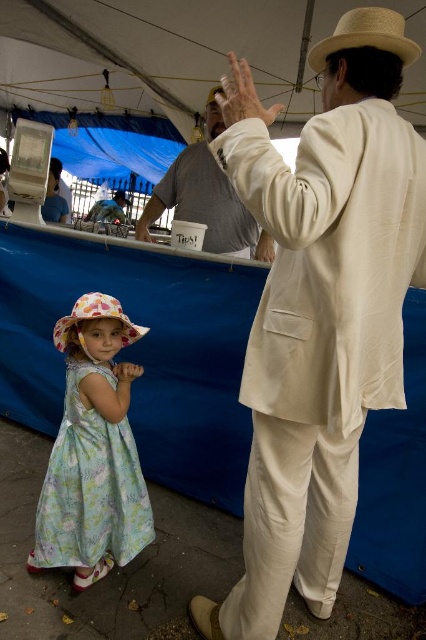
Between point (379, 40) and point (207, 104), which one is positioned in front?

Point (379, 40) is more forward.

Does point (385, 12) lie behind point (218, 88)?

That is False.

Who is more distant from viewer, (417, 54) or (210, 97)?

The point (210, 97) is behind.

This screenshot has height=640, width=426. Find the location of `natural straw cowboy hat at upper right`. natural straw cowboy hat at upper right is located at coordinates (365, 36).

Does natural straw cowboy hat at upper right have a greater width compared to floral fabric sunhat at lower left?

No, natural straw cowboy hat at upper right is not wider than floral fabric sunhat at lower left.

Which is below, natural straw cowboy hat at upper right or floral fabric sunhat at lower left?

floral fabric sunhat at lower left is lower down.

Identify the location of natural straw cowboy hat at upper right. The image size is (426, 640). (365, 36).

Image resolution: width=426 pixels, height=640 pixels. I want to click on natural straw cowboy hat at upper right, so click(x=365, y=36).

Which of these two, floral cotton dress at lower left or floral fabric sunhat at lower left, stands taller?

floral cotton dress at lower left

Who is more forward, (74,496) or (75,307)?

Point (75,307) is in front.

This screenshot has width=426, height=640. What do you see at coordinates (91, 486) in the screenshot?
I see `floral cotton dress at lower left` at bounding box center [91, 486].

This screenshot has width=426, height=640. I want to click on floral cotton dress at lower left, so click(91, 486).